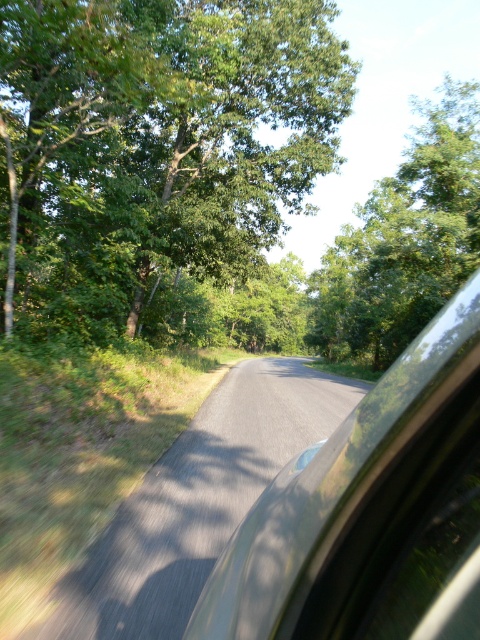
Question: Considering the real-world distances, which object is farthest from the green leafy tree at upper center?

Choices:
 (A) green leafy tree at upper right
 (B) metallic silver car at center

Answer: (A)

Question: Is green leafy tree at upper center positioned before green leafy tree at upper right?

Choices:
 (A) no
 (B) yes

Answer: (B)

Question: Among these points, which one is farthest from the camera?

Choices:
 (A) (446, 195)
 (B) (350, 632)

Answer: (A)

Question: Which of the following is the farthest from the observer?

Choices:
 (A) metallic silver car at center
 (B) green leafy tree at upper center

Answer: (B)

Question: Does green leafy tree at upper center have a lesser width compared to green leafy tree at upper right?

Choices:
 (A) no
 (B) yes

Answer: (B)

Question: Can you confirm if green leafy tree at upper center is positioned above green leafy tree at upper right?

Choices:
 (A) no
 (B) yes

Answer: (A)